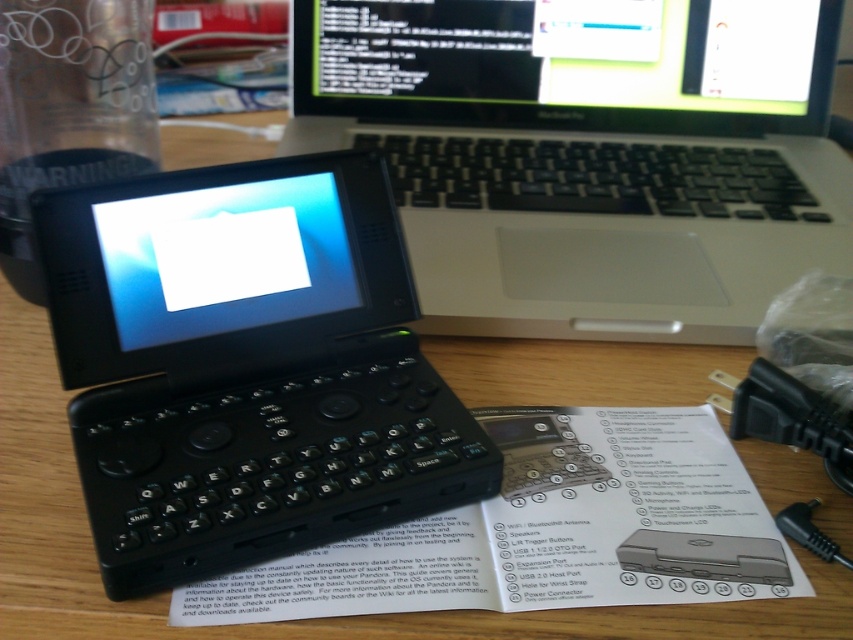
You are organizing your desk and need to place both the white paper at center and the black plastic keyboard at center. Based on their sizes, which object should you place first if you want to ensure the taller item is placed before the shorter one?

The black plastic keyboard at center is taller than the white paper at center, so you should place the black plastic keyboard at center first to follow the requirement.